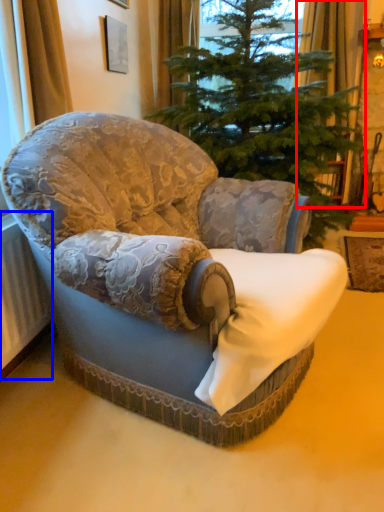
Question: Which point is closer to the camera, curtain (highlighted by a red box) or radiator (highlighted by a blue box)?

Choices:
 (A) curtain
 (B) radiator

Answer: (B)